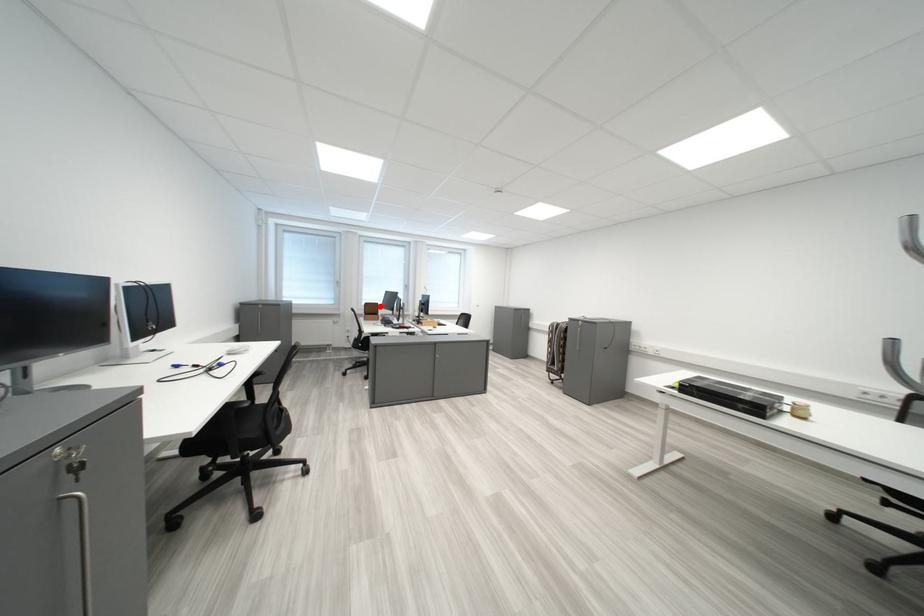
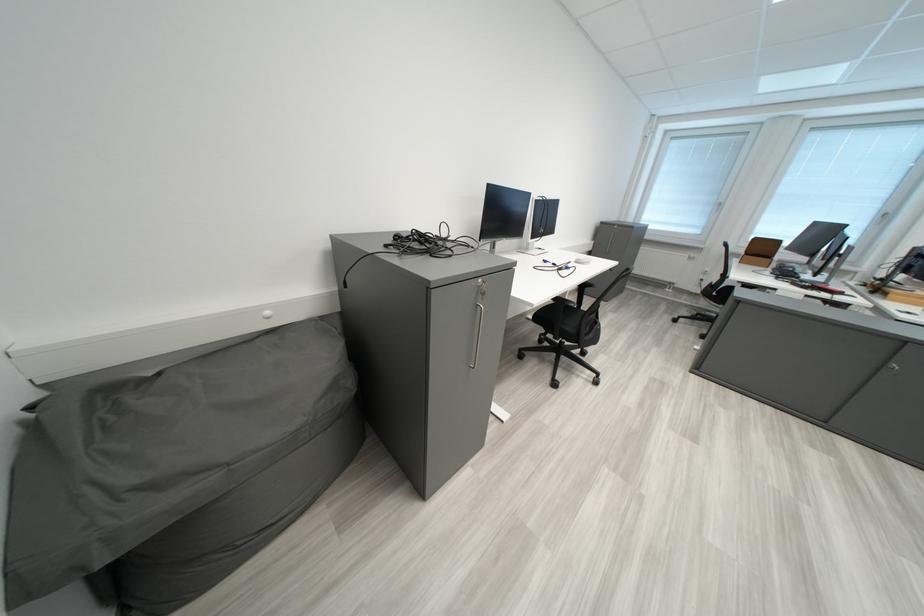
Find the pixel in the second image that matches the highlighted location in the first image.

(769, 241)